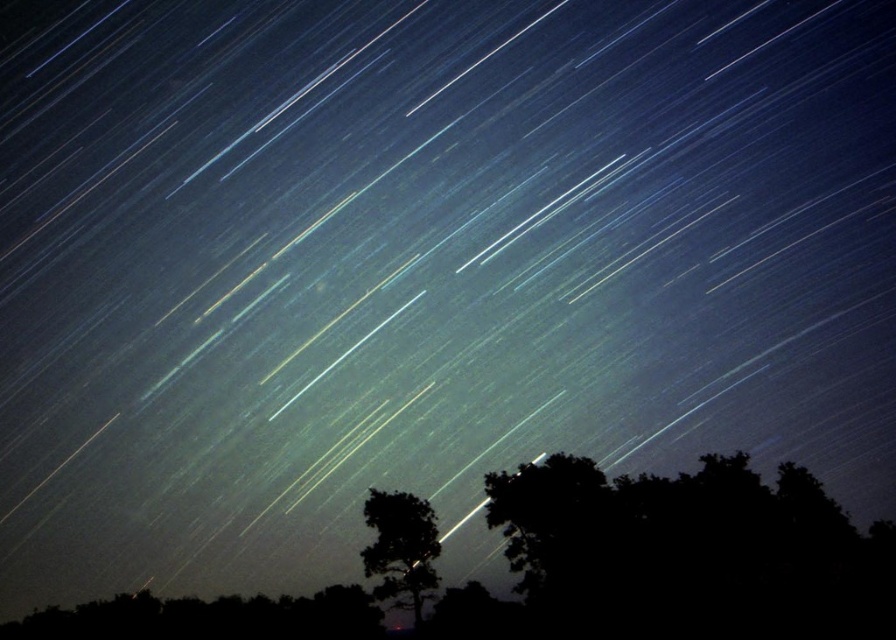
You are an astronomer analyzing the night sky image. You notice two trees in the foreground. Which tree, the black silhouetted tree at lower right or the silhouette tree at center, appears larger in the image?

The black silhouetted tree at lower right appears larger because it is much taller than the silhouette tree at center.

You are an astronomer analyzing the night sky image. You notice two trees in the foreground. Which tree, the black silhouetted tree at lower right or the silhouette tree at center, is closer to the horizon line?

The black silhouetted tree at lower right is closer to the horizon line because it is positioned below the silhouette tree at center, which places it nearer to the horizon.

You are an astronomer analyzing the night sky image. You notice two points of light labeled as point (686, 560) and point (382, 552). Based on their positions, which point is closer to the camera?

Point (686, 560) is closer to the camera than point (382, 552).